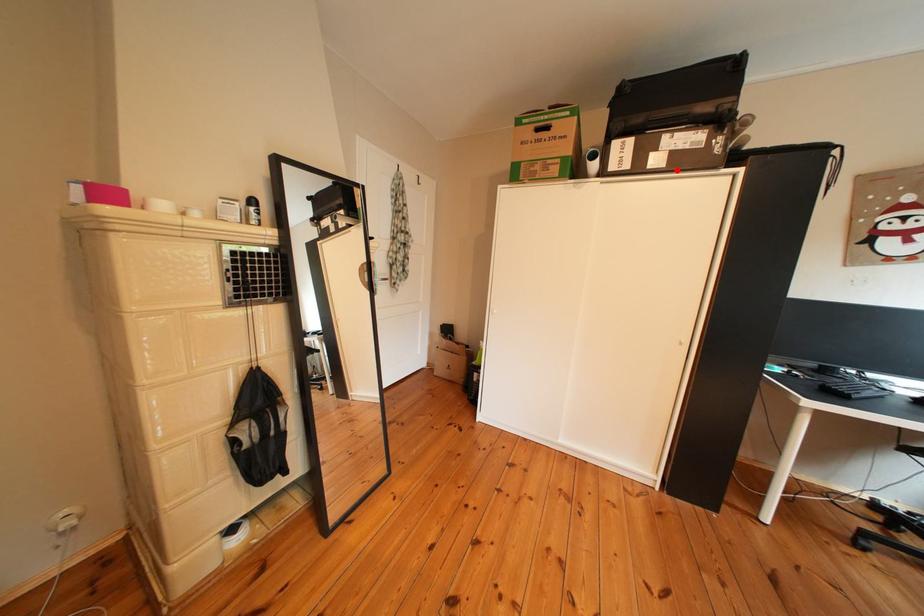
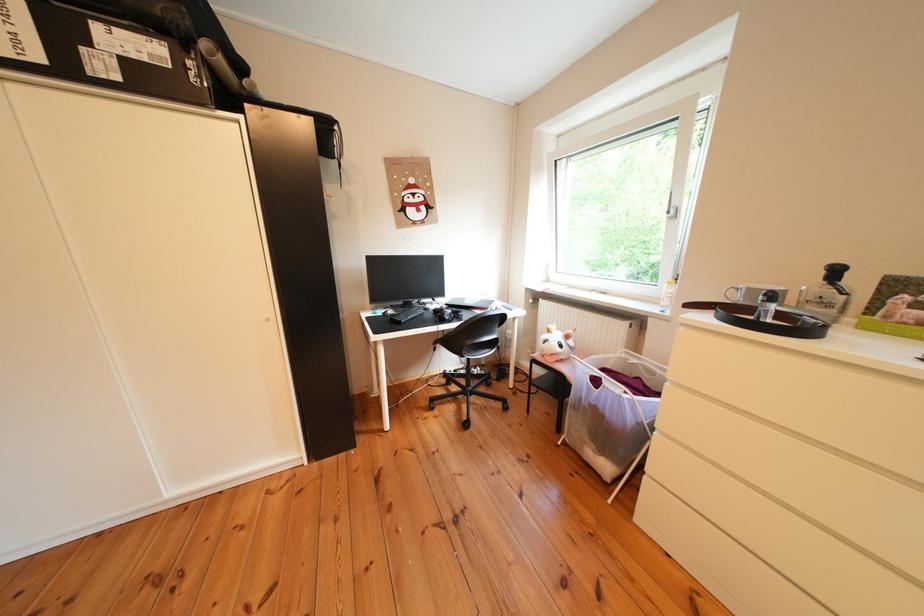
Locate, in the second image, the point that corresponds to the highlighted location in the first image.

(131, 83)